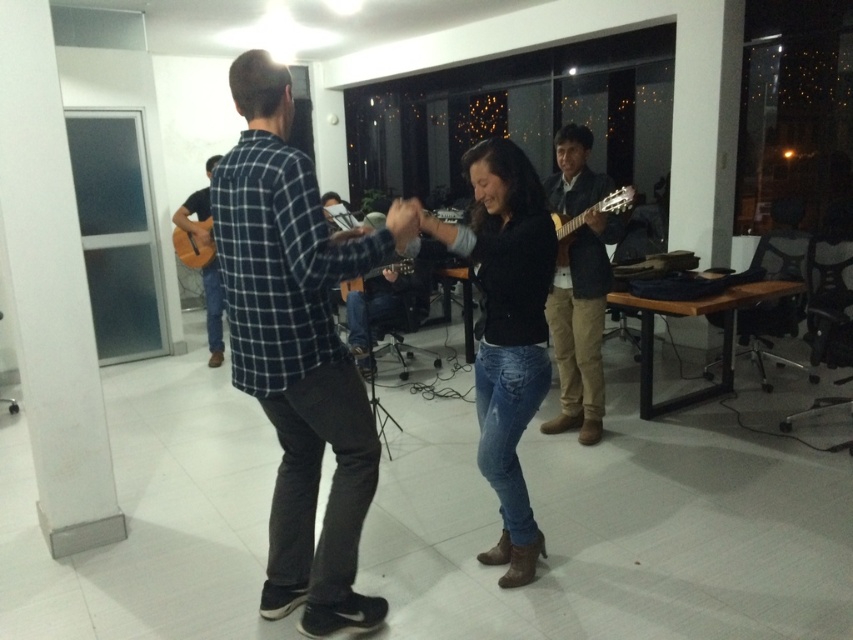
You are a photographer standing at the back of the room. You want to take a photo of the blue plaid shirt at center and the wooden acoustic guitar at left. Can you position yourself so that both objects are visible in the same frame without moving any objects?

The blue plaid shirt at center is below the wooden acoustic guitar at left, so yes, you can position yourself to include both in the frame since the shirt is positioned lower and the guitar is above it.

You are standing in the room and want to hand a pair of brown suede shoes at right to someone behind you. Can you reach them without moving your feet?

The brown suede shoes at right is 3.45 meters away from the viewer, so you cannot reach them without moving your feet since the distance is too far.

You are standing in the room and want to move from the point at coordinates point (613, 220) to the point at coordinates point (554, 228). Which direction should you move to get closer to your destination?

You should move forward because point (613, 220) is further away from you than point (554, 228), so moving toward the destination will bring you closer.